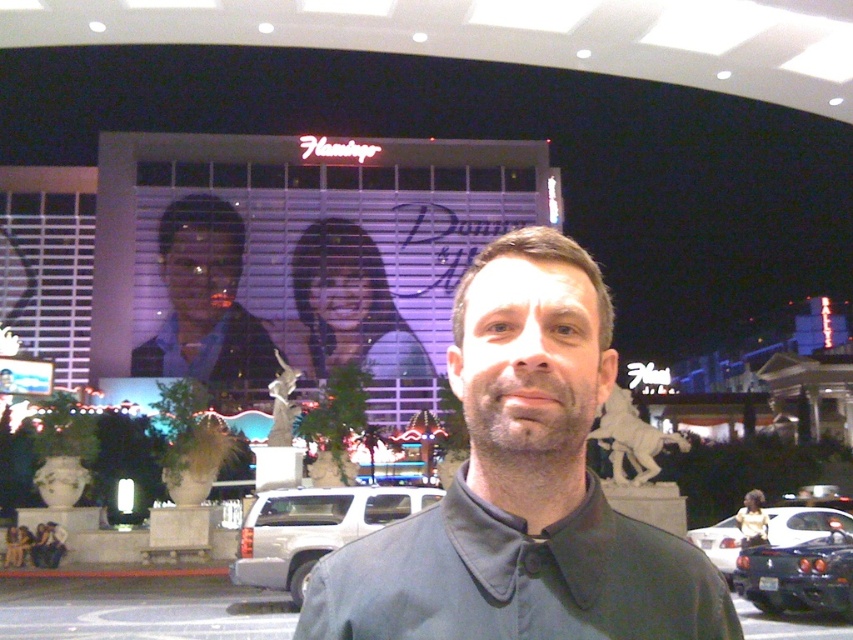
You are a photographer taking a picture of the dark gray cotton dress shirt at center and the matte black man at center. Which object should you adjust your camera focus on first if you want to capture both clearly?

You should focus on the matte black man at center first because the dark gray cotton dress shirt at center is to the right of matte black man at center, so adjusting focus on the closer object first would ensure both are in focus.